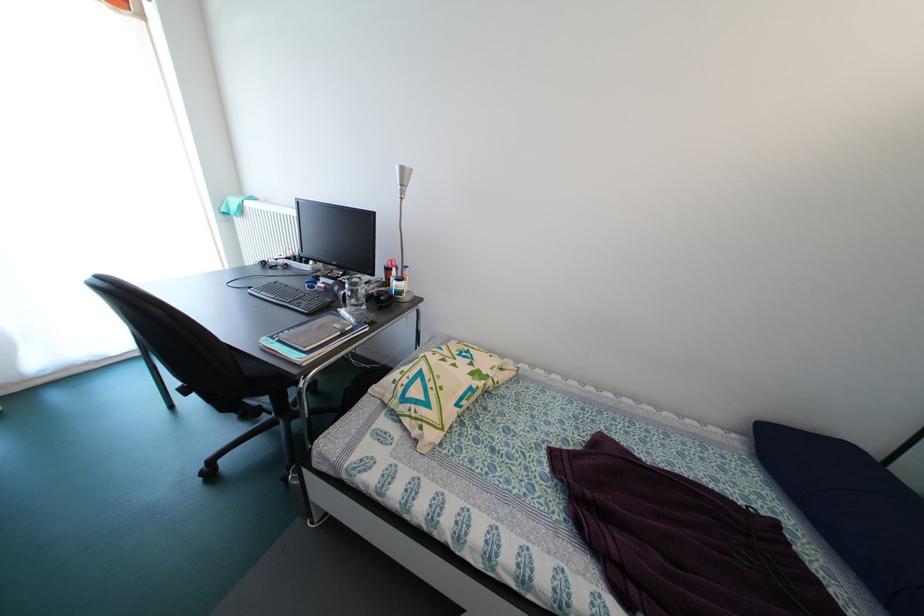
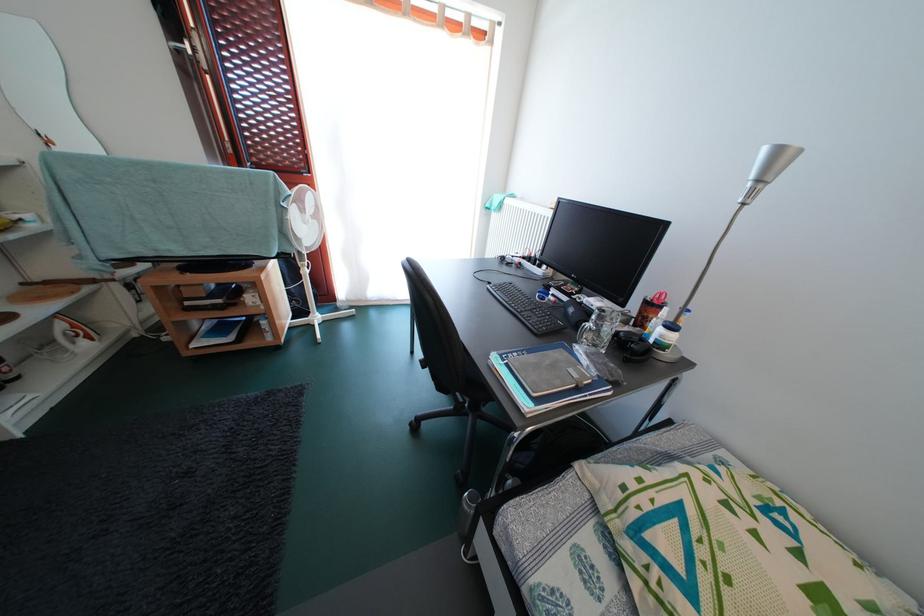
In the second image, find the point that corresponds to the point at 274,207 in the first image.

(529, 204)